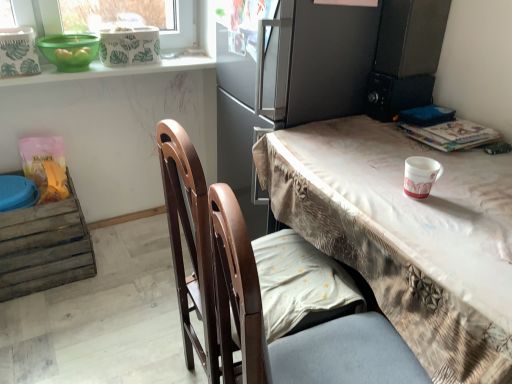
Question: Can you confirm if white paper cup at right is bigger than green plastic bowl at upper left?

Choices:
 (A) yes
 (B) no

Answer: (B)

Question: Does white paper cup at right have a lesser width compared to green plastic bowl at upper left?

Choices:
 (A) no
 (B) yes

Answer: (B)

Question: From the image's perspective, is white paper cup at right below green plastic bowl at upper left?

Choices:
 (A) no
 (B) yes

Answer: (B)

Question: From the image's perspective, is white paper cup at right above green plastic bowl at upper left?

Choices:
 (A) no
 (B) yes

Answer: (A)

Question: Is white paper cup at right positioned behind green plastic bowl at upper left?

Choices:
 (A) yes
 (B) no

Answer: (B)

Question: Considering the relative positions of green plastic bowl at upper left and brown wooden chair at center in the image provided, is green plastic bowl at upper left to the left or to the right of brown wooden chair at center?

Choices:
 (A) left
 (B) right

Answer: (A)

Question: Based on their sizes in the image, would you say green plastic bowl at upper left is bigger or smaller than brown wooden chair at center?

Choices:
 (A) big
 (B) small

Answer: (B)

Question: In terms of height, does green plastic bowl at upper left look taller or shorter compared to brown wooden chair at center?

Choices:
 (A) short
 (B) tall

Answer: (A)

Question: Relative to brown wooden chair at center, is green plastic bowl at upper left in front or behind?

Choices:
 (A) front
 (B) behind

Answer: (B)

Question: Would you say hardcover book at upper right is inside or outside green plastic bowl at upper left?

Choices:
 (A) outside
 (B) inside

Answer: (A)

Question: From the image's perspective, relative to green plastic bowl at upper left, is hardcover book at upper right above or below?

Choices:
 (A) above
 (B) below

Answer: (B)

Question: In the image, is hardcover book at upper right positioned in front of or behind green plastic bowl at upper left?

Choices:
 (A) front
 (B) behind

Answer: (A)

Question: From a real-world perspective, is hardcover book at upper right above or below green plastic bowl at upper left?

Choices:
 (A) below
 (B) above

Answer: (A)

Question: Visually, is green plastic bowl at upper left positioned to the left or to the right of matte gray fridge at upper center?

Choices:
 (A) right
 (B) left

Answer: (B)

Question: Is green plastic bowl at upper left spatially inside matte gray fridge at upper center, or outside of it?

Choices:
 (A) inside
 (B) outside

Answer: (B)